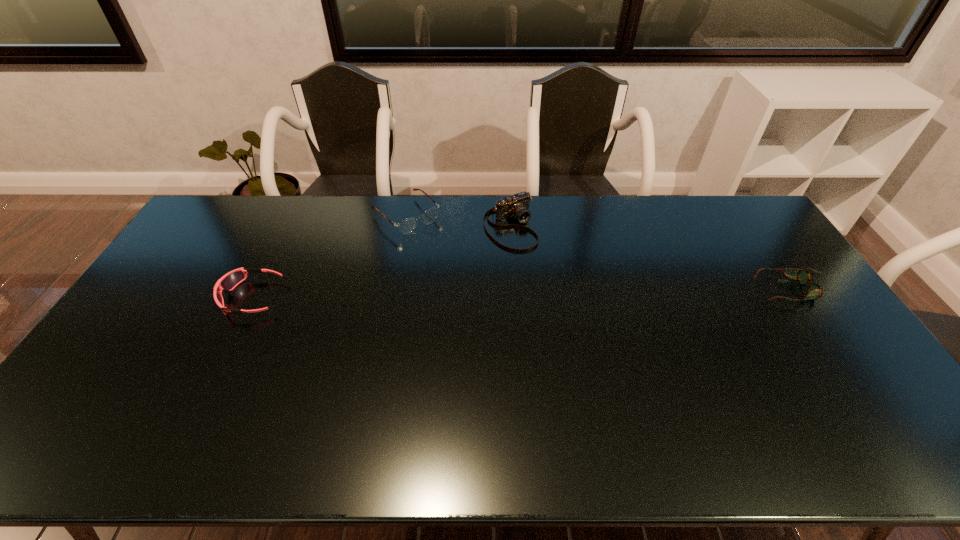
Image resolution: width=960 pixels, height=540 pixels. Find the location of `vacant space located 0.070m on the front-facing side of the shorter spectacles`. vacant space located 0.070m on the front-facing side of the shorter spectacles is located at coordinates (737, 289).

Find the location of a particular element. The height and width of the screenshot is (540, 960). vacant space located on the front-facing side of the shorter spectacles is located at coordinates (721, 289).

Locate an element on the screen. vacant space located 0.160m on the front-facing side of the camera is located at coordinates (549, 279).

In order to click on blank space located 0.150m on the front-facing side of the camera in this screenshot , I will do `click(547, 276)`.

You are a GUI agent. You are given a task and a screenshot of the screen. Output one action in this format:
    pyautogui.click(x=<x>, y=<y>)
    Task: Click on the vacant region located 0.110m on the front-facing side of the camera
    The image size is (960, 540).
    Given the screenshot: What is the action you would take?
    pyautogui.click(x=541, y=269)

Where is `vacant region located on the front-facing side of the farther spectacles`? The width and height of the screenshot is (960, 540). vacant region located on the front-facing side of the farther spectacles is located at coordinates (466, 270).

This screenshot has width=960, height=540. I want to click on vacant area situated 0.210m on the front-facing side of the farther spectacles, so click(461, 265).

Locate an element on the screen. vacant space located on the front-facing side of the farther spectacles is located at coordinates (457, 262).

The height and width of the screenshot is (540, 960). Identify the location of camera positioned at the far edge. (517, 206).

Find the location of a particular element. spectacles that is at the far edge is located at coordinates (406, 226).